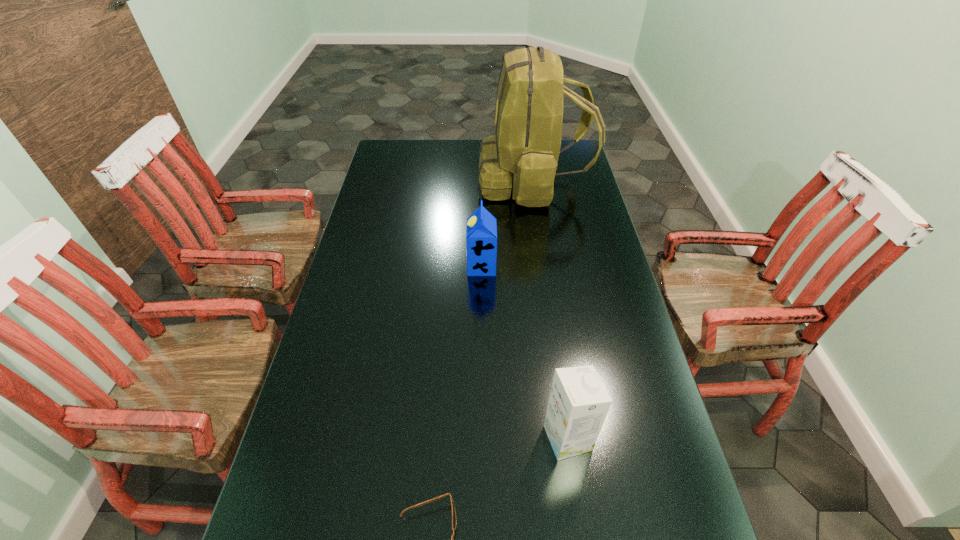
This screenshot has width=960, height=540. I want to click on the tallest object, so click(x=523, y=155).

Find the location of a particular element. Image resolution: width=960 pixels, height=540 pixels. backpack is located at coordinates (523, 155).

Identify the location of the nearer carton. (578, 404).

At what (x,y) coordinates should I click in order to perform the action: click on the third farthest object. Please return your answer as a coordinate pair (x, y). The height and width of the screenshot is (540, 960). Looking at the image, I should click on (578, 404).

I want to click on the third nearest object, so [x=481, y=234].

Image resolution: width=960 pixels, height=540 pixels. Identify the location of the farther carton. (481, 234).

Where is `vacant space located on the front-facing side of the tallest object`? The width and height of the screenshot is (960, 540). vacant space located on the front-facing side of the tallest object is located at coordinates (403, 180).

Identify the location of free space located on the front-facing side of the tallest object. This screenshot has width=960, height=540. (396, 180).

Where is `vacant region located 0.170m on the front-facing side of the tallest object`? The width and height of the screenshot is (960, 540). vacant region located 0.170m on the front-facing side of the tallest object is located at coordinates (436, 180).

This screenshot has height=540, width=960. What are the coordinates of `vacant space located on the left of the third farthest object` in the screenshot? It's located at (406, 438).